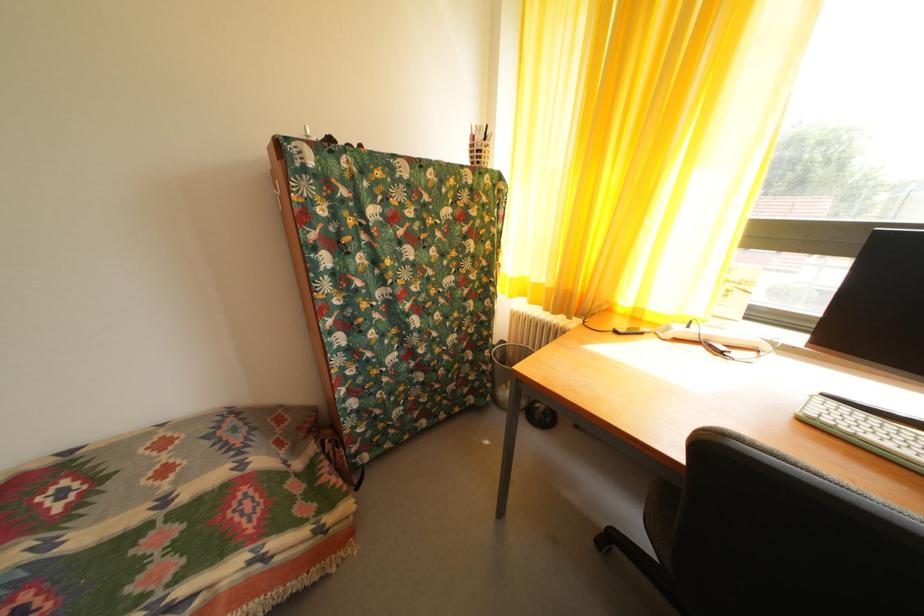
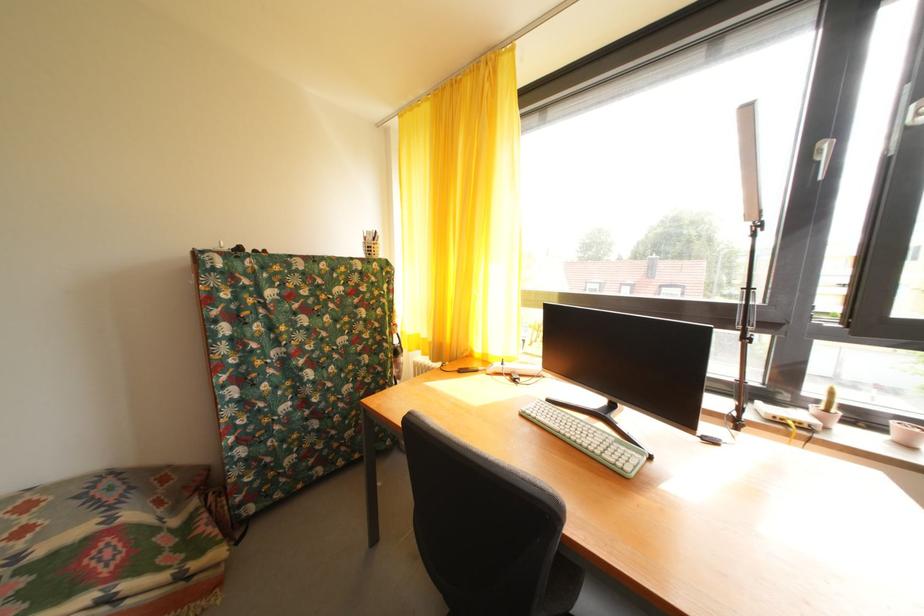
The point at (543, 291) is marked in the first image. Where is the corresponding point in the second image?

(432, 346)